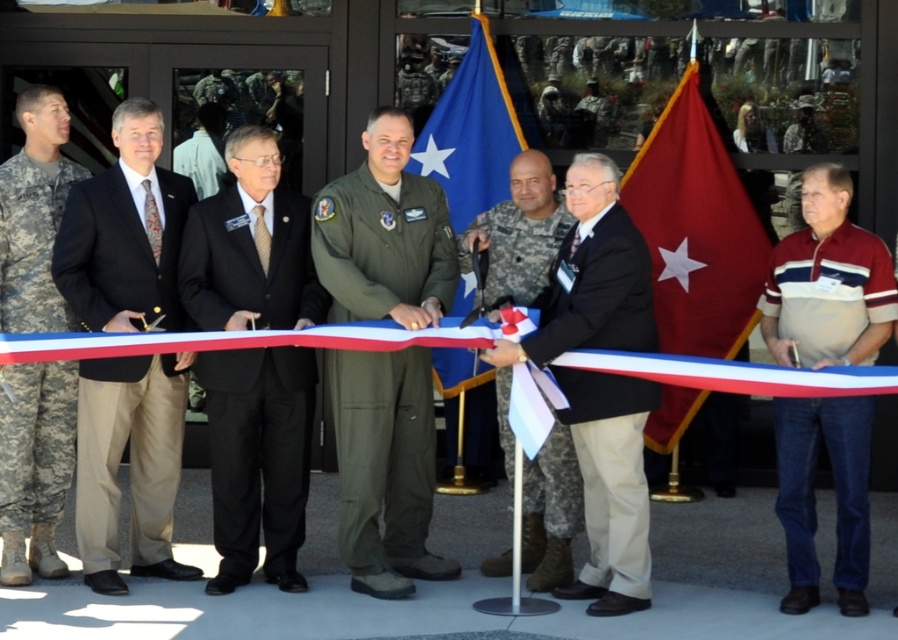
Question: From the image, what is the correct spatial relationship of black suit at center in relation to blue fabric flag at center?

Choices:
 (A) left
 (B) right

Answer: (A)

Question: Is red fabric flag at center bigger than camouflage uniform at center?

Choices:
 (A) no
 (B) yes

Answer: (B)

Question: Can you confirm if green uniform at center is positioned below camouflage fabric uniform at left?

Choices:
 (A) no
 (B) yes

Answer: (A)

Question: Which object is closer to the camera taking this photo?

Choices:
 (A) black suit at left
 (B) camouflage fabric uniform at left

Answer: (A)

Question: Which object is closer to the camera taking this photo?

Choices:
 (A) black fabric suit at center
 (B) maroon striped polo shirt at right
 (C) camouflage uniform at center

Answer: (B)

Question: Which point is closer to the camera?

Choices:
 (A) (850, 241)
 (B) (624, 404)
 (C) (518, 269)
 (D) (157, 321)

Answer: (B)